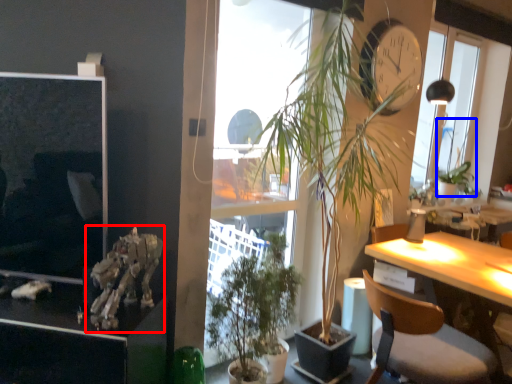
Question: Which of the following is the closest to the observer, skeleton (highlighted by a red box) or vegetation (highlighted by a blue box)?

Choices:
 (A) skeleton
 (B) vegetation

Answer: (A)